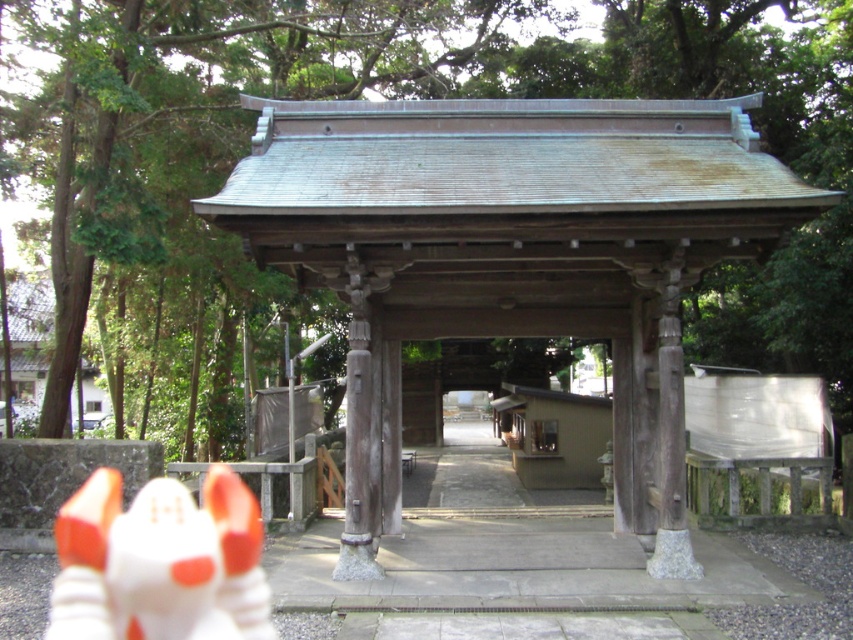
Question: Observing the image, what is the correct spatial positioning of wooden gazebo at center in reference to white matte toy at lower left?

Choices:
 (A) left
 (B) right

Answer: (B)

Question: Is wooden gazebo at center bigger than white matte toy at lower left?

Choices:
 (A) no
 (B) yes

Answer: (A)

Question: Which point is farther to the camera?

Choices:
 (A) white matte toy at lower left
 (B) wooden gazebo at center

Answer: (B)

Question: Can you confirm if wooden gazebo at center is positioned to the left of white matte toy at lower left?

Choices:
 (A) no
 (B) yes

Answer: (A)

Question: Which of the following is the farthest from the observer?

Choices:
 (A) white matte toy at lower left
 (B) wooden gazebo at center

Answer: (B)

Question: Which point is farther from the camera taking this photo?

Choices:
 (A) (152, 497)
 (B) (641, 177)

Answer: (A)